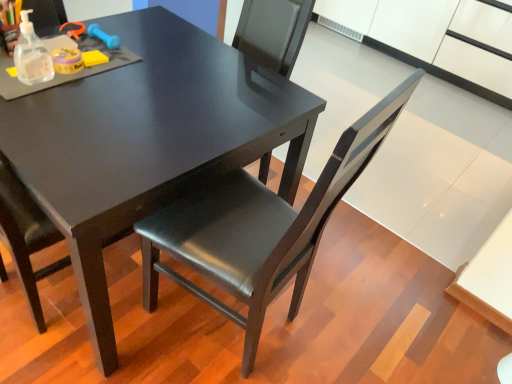
Image resolution: width=512 pixels, height=384 pixels. Describe the element at coordinates (260, 228) in the screenshot. I see `matte black chair at center` at that location.

Where is `matte black chair at center`? Image resolution: width=512 pixels, height=384 pixels. matte black chair at center is located at coordinates (260, 228).

What do you see at coordinates (148, 140) in the screenshot? I see `matte black table at center` at bounding box center [148, 140].

The image size is (512, 384). I want to click on matte black table at center, so click(148, 140).

At what (x,y) coordinates should I click in order to perform the action: click on matte black chair at center. Please return your answer as a coordinate pair (x, y). Looking at the image, I should click on (260, 228).

Which object is positioned more to the left, matte black chair at center or matte black table at center?

From the viewer's perspective, matte black table at center appears more on the left side.

Does matte black chair at center come behind matte black table at center?

No, matte black chair at center is in front of matte black table at center.

Is point (195, 241) positioned in front of point (87, 309)?

Yes.

From the image's perspective, which object appears higher, matte black chair at center or matte black table at center?

matte black table at center.

From a real-world perspective, between matte black chair at center and matte black table at center, who is vertically higher?

matte black chair at center is physically above.

In terms of width, does matte black chair at center look wider or thinner when compared to matte black table at center?

Clearly, matte black chair at center has less width compared to matte black table at center.

Is matte black chair at center taller or shorter than matte black table at center?

In the image, matte black chair at center appears to be taller than matte black table at center.

Is matte black chair at center bigger than matte black table at center?

No.

Can we say matte black chair at center lies outside matte black table at center?

matte black chair at center lies outside matte black table at center's area.

Would you say matte black chair at center is a long distance from matte black table at center?

That's not correct — matte black chair at center is a little close to matte black table at center.

Is matte black chair at center facing towards matte black table at center?

Yes.

How different are the orientations of matte black chair at center and matte black table at center in degrees?

95.9 degrees.

Measure the distance between matte black chair at center and matte black table at center.

matte black chair at center and matte black table at center are 12.91 inches apart from each other.

This screenshot has width=512, height=384. I want to click on table on the left of matte black chair at center, so click(148, 140).

Is matte black table at center to the left or to the right of matte black chair at center in the image?

matte black table at center is positioned on matte black chair at center's left side.

Consider the image. Between matte black table at center and matte black chair at center, which one is positioned behind?

Positioned behind is matte black table at center.

Considering the points (103, 119) and (308, 252), which point is behind, point (103, 119) or point (308, 252)?

The point (308, 252) is farther.

From the image's perspective, is matte black table at center above matte black chair at center?

Yes, from the image's perspective, matte black table at center is above matte black chair at center.

From a real-world perspective, is matte black table at center beneath matte black chair at center?

Yes.

Between matte black table at center and matte black chair at center, which one has smaller width?

matte black chair at center is thinner.

Based on the photo, considering the relative sizes of matte black table at center and matte black chair at center in the image provided, is matte black table at center shorter than matte black chair at center?

Correct, matte black table at center is not as tall as matte black chair at center.

Does matte black table at center have a larger size compared to matte black chair at center?

Yes, matte black table at center is bigger than matte black chair at center.

Can matte black chair at center be found inside matte black table at center?

That's incorrect, matte black chair at center is not inside matte black table at center.

Is matte black table at center with matte black chair at center?

No, matte black table at center is not next to matte black chair at center.

Could you tell me if matte black table at center is turned towards matte black chair at center?

No, matte black table at center is not oriented towards matte black chair at center.

What's the angular difference between matte black table at center and matte black chair at center's facing directions?

The angular difference between matte black table at center and matte black chair at center is 95.9 degrees.

How distant is matte black table at center from matte black chair at center?

A distance of 12.91 inches exists between matte black table at center and matte black chair at center.

I want to click on chair that appears on the right of matte black table at center, so click(260, 228).

The image size is (512, 384). Identify the location of table below the matte black chair at center (from a real-world perspective). (148, 140).

This screenshot has height=384, width=512. Find the location of `chair below the matte black table at center (from the image's perspective)`. chair below the matte black table at center (from the image's perspective) is located at coordinates (260, 228).